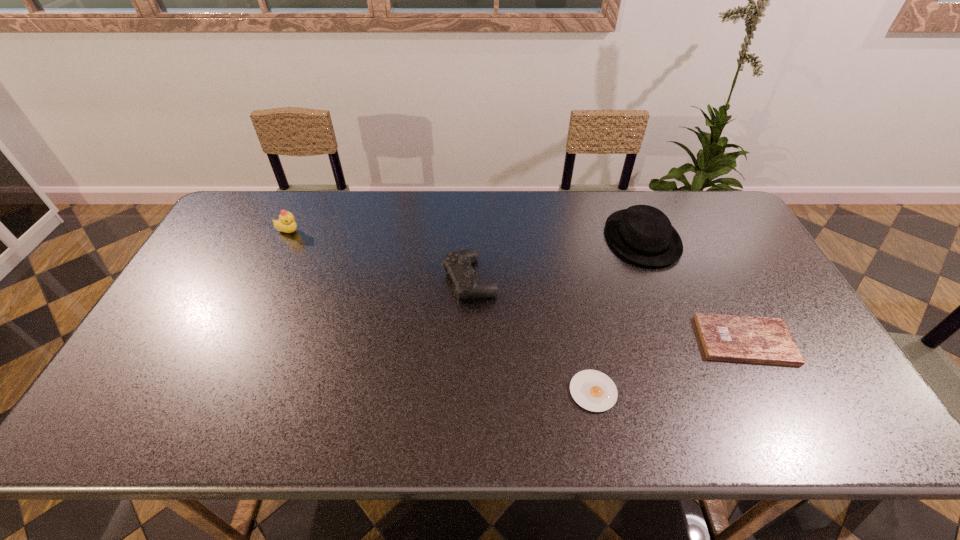
Find the location of a particular element. Image resolution: width=960 pixels, height=540 pixels. the leftmost object is located at coordinates (286, 223).

Identify the location of fedora. The image size is (960, 540). (643, 234).

Find the location of `control`. control is located at coordinates (458, 264).

You are a GUI agent. You are given a task and a screenshot of the screen. Output one action in this format:
    pyautogui.click(x=<x>, y=<y>)
    Task: Click on the second object from left to right
    Image resolution: width=960 pixels, height=540 pixels.
    Given the screenshot: What is the action you would take?
    pyautogui.click(x=458, y=264)

At what (x,y) coordinates should I click in order to perform the action: click on Bible. Please return your answer as a coordinate pair (x, y). Looking at the image, I should click on (764, 340).

Find the location of a particular element. The height and width of the screenshot is (540, 960). the second nearest object is located at coordinates (x=764, y=340).

Image resolution: width=960 pixels, height=540 pixels. In order to click on the nearest object in this screenshot , I will do `click(593, 390)`.

Identify the location of the third object from right to left. Image resolution: width=960 pixels, height=540 pixels. (593, 390).

Identify the location of blank space located on the front-facing side of the duckling. [x=350, y=232].

Identify the location of vacant space located 0.270m on the left of the fedora. (522, 238).